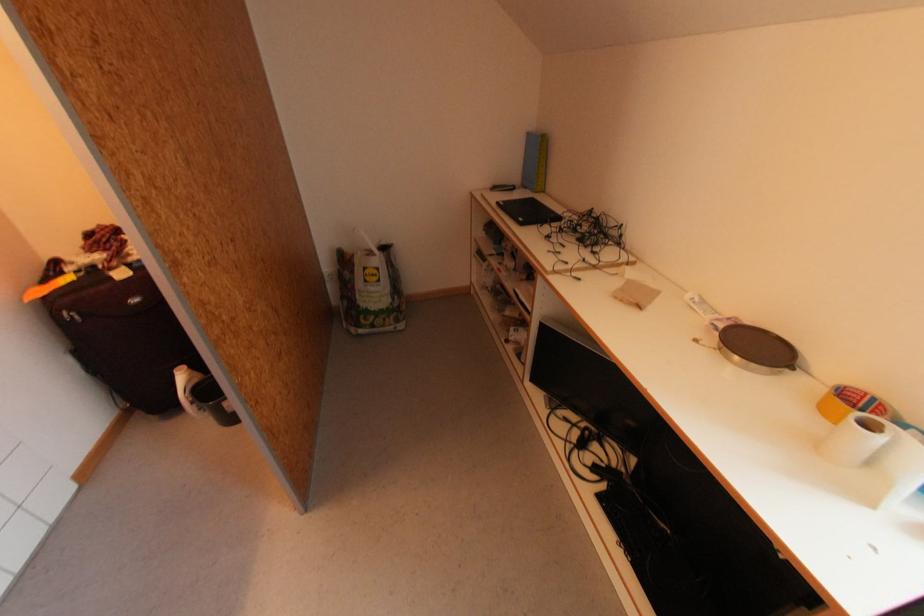
This screenshot has width=924, height=616. What are the coordinates of `black suitcase handle` in the screenshot? It's located at [88, 270].